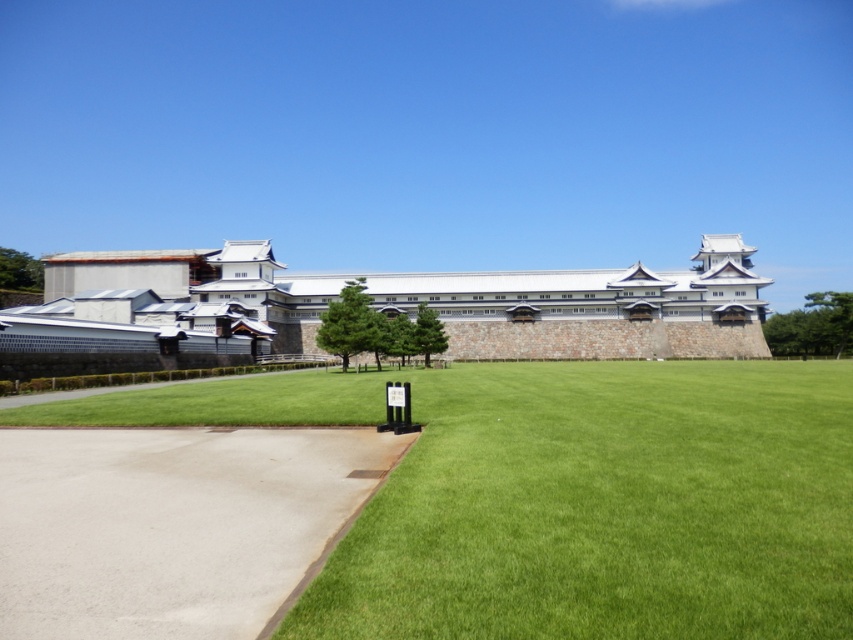
Question: Does green grass at center appear on the right side of smooth concrete path at lower left?

Choices:
 (A) no
 (B) yes

Answer: (B)

Question: Based on their relative distances, which object is farther from the white stone wall at center?

Choices:
 (A) smooth concrete path at lower left
 (B) green grass at center

Answer: (A)

Question: Is green grass at center positioned behind white stone wall at center?

Choices:
 (A) no
 (B) yes

Answer: (A)

Question: Which of the following is the closest to the observer?

Choices:
 (A) (83, 618)
 (B) (660, 532)

Answer: (A)

Question: Is green grass at center smaller than smooth concrete path at lower left?

Choices:
 (A) no
 (B) yes

Answer: (A)

Question: Which point appears farthest from the camera in this image?

Choices:
 (A) (393, 513)
 (B) (698, 326)
 (C) (105, 627)

Answer: (B)